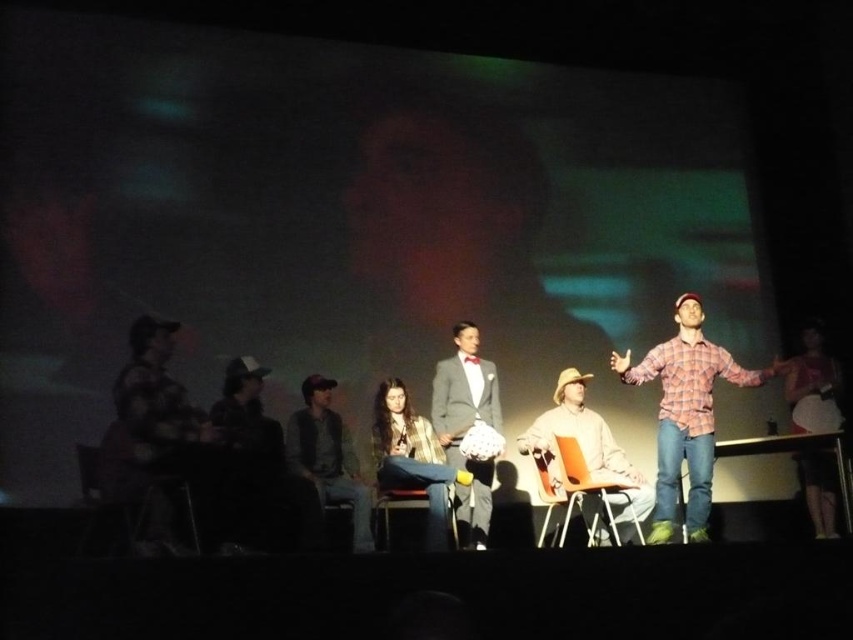
Between matte gray suit at center and gray wool sweater at center, which one is positioned higher?

matte gray suit at center is above.

Can you confirm if matte gray suit at center is positioned below gray wool sweater at center?

Incorrect, matte gray suit at center is not positioned below gray wool sweater at center.

Does point (480, 465) lie behind point (315, 451)?

That is True.

This screenshot has height=640, width=853. What are the coordinates of `matte gray suit at center` in the screenshot? It's located at (466, 426).

Who is more forward, (109, 522) or (436, 536)?

Positioned in front is point (109, 522).

Which is more to the left, metallic silver chair at lower left or plaid fabric shirt at center?

metallic silver chair at lower left

Is point (113, 444) positioned in front of point (384, 468)?

Yes.

Where is `metallic silver chair at lower left`? metallic silver chair at lower left is located at coordinates (134, 504).

Based on the photo, is matte gray suit at center behind orange plastic chair at center?

Yes.

What do you see at coordinates (466, 426) in the screenshot?
I see `matte gray suit at center` at bounding box center [466, 426].

Is point (476, 500) positioned behind point (612, 522)?

Yes, point (476, 500) is behind point (612, 522).

Identify the location of matte gray suit at center. (466, 426).